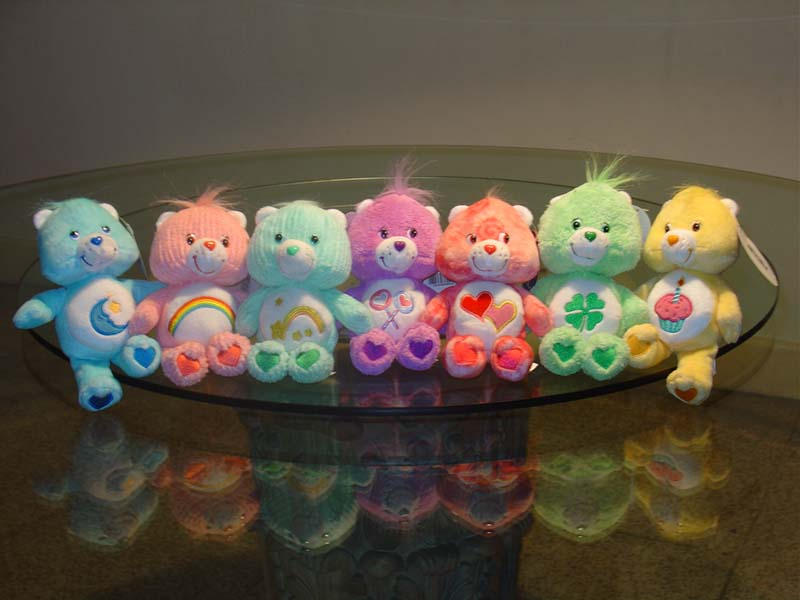
Locate an element on the screen. purple stuffed bear is located at coordinates (398, 215).